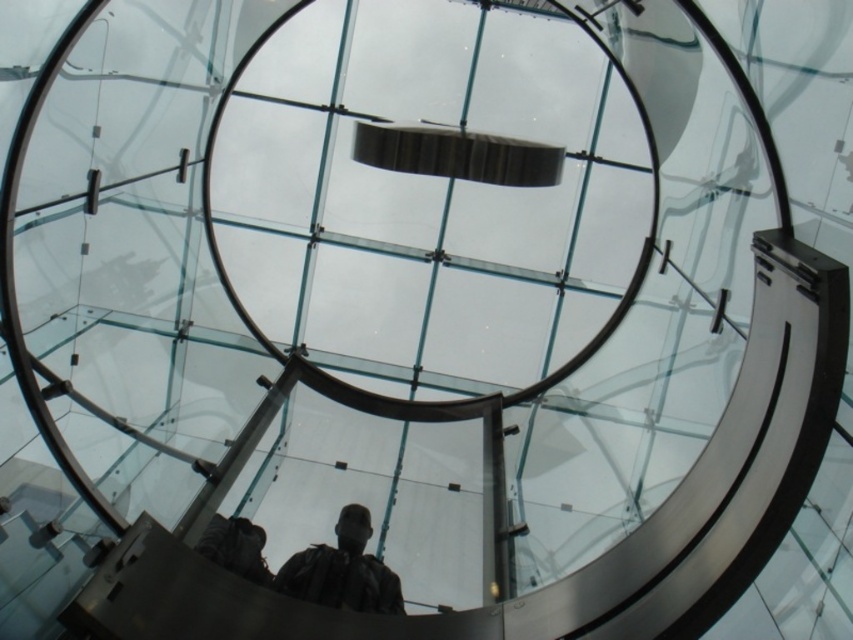
Question: Does dark brown leather jacket at lower center have a greater width compared to dark gray jacket at lower center?

Choices:
 (A) no
 (B) yes

Answer: (B)

Question: Which point is closer to the camera?

Choices:
 (A) (285, 586)
 (B) (247, 522)

Answer: (A)

Question: Observing the image, what is the correct spatial positioning of dark brown leather jacket at lower center in reference to dark gray jacket at lower center?

Choices:
 (A) right
 (B) left

Answer: (A)

Question: Does dark brown leather jacket at lower center have a greater width compared to dark gray jacket at lower center?

Choices:
 (A) no
 (B) yes

Answer: (B)